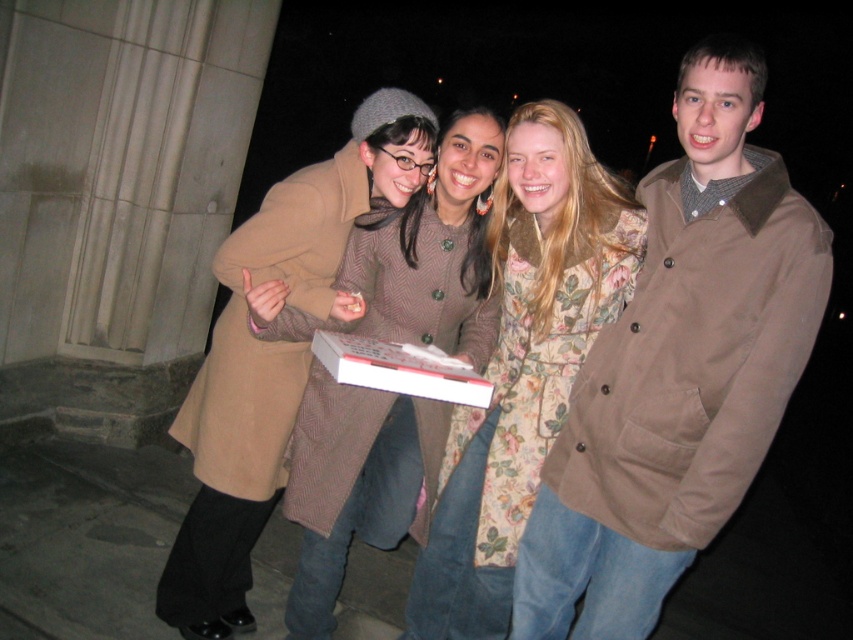
Question: Which point is closer to the camera?

Choices:
 (A) (556, 636)
 (B) (331, 326)
 (C) (613, 310)

Answer: (C)

Question: Is brown cotton jacket at right behind floral-patterned coat at center?

Choices:
 (A) yes
 (B) no

Answer: (B)

Question: Estimate the real-world distances between objects in this image. Which object is farther from the brown wool coat at center?

Choices:
 (A) floral-patterned coat at center
 (B) brown cotton jacket at right

Answer: (B)

Question: Does brown cotton jacket at right appear on the right side of floral-patterned coat at center?

Choices:
 (A) yes
 (B) no

Answer: (A)

Question: Which object is the closest to the floral-patterned coat at center?

Choices:
 (A) brown wool coat at center
 (B) brown cotton jacket at right

Answer: (A)

Question: Does brown cotton jacket at right appear on the right side of brown wool coat at center?

Choices:
 (A) yes
 (B) no

Answer: (A)